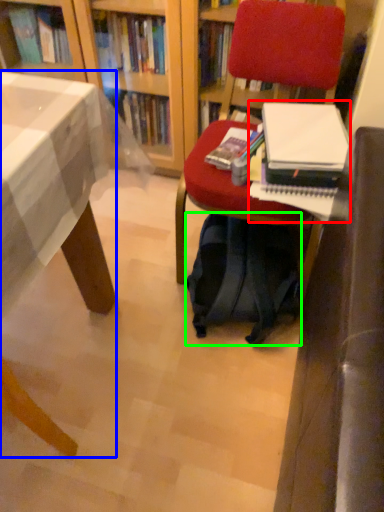
Question: Which object is positioned farthest from paperback book (highlighted by a red box)? Select from desk (highlighted by a blue box) and backpack (highlighted by a green box).

Choices:
 (A) desk
 (B) backpack

Answer: (A)